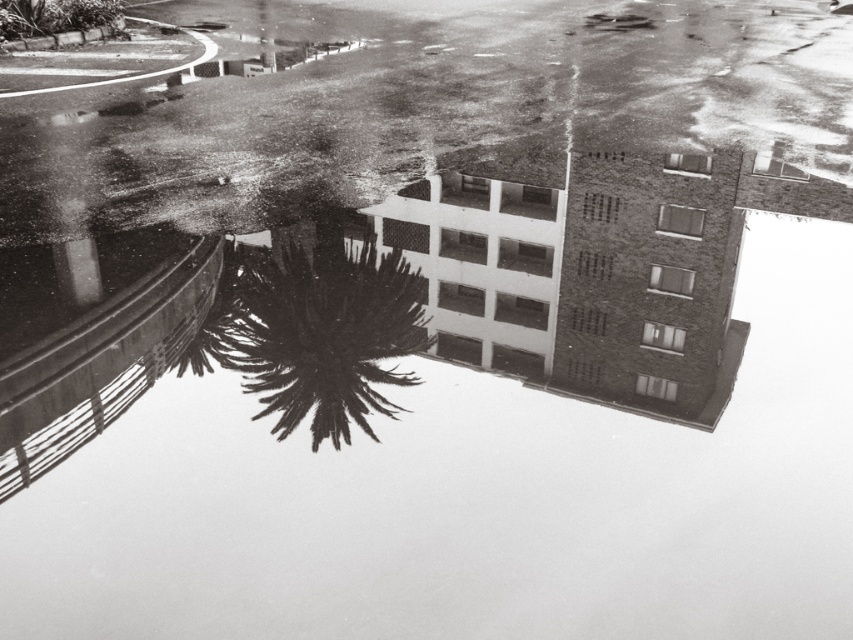
Is dark green spiky palm tree at center closer to the viewer compared to green leafy tree at upper left?

Yes, it is.

Who is lower down, dark green spiky palm tree at center or green leafy tree at upper left?

dark green spiky palm tree at center is lower down.

Which is behind, point (281, 392) or point (0, 1)?

The point (0, 1) is behind.

Find the location of a particular element. dark green spiky palm tree at center is located at coordinates (314, 330).